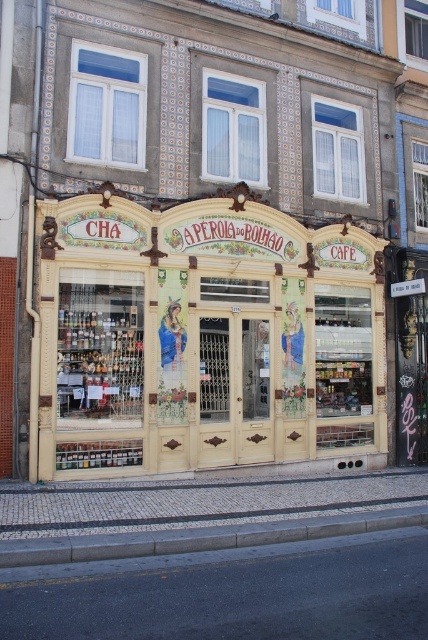
You are a delivery person trying to park your 1.2 meter wide cart in front of the yellow painted wood storefront at center. The gray concrete curb at lower center is in the way. Can your cart fit between the storefront and the curb?

The yellow painted wood storefront at center has a lesser width compared to gray concrete curb at lower center. Since the storefront is narrower, there might not be enough space for the 1.2 meter wide cart to fit between them. You should look for another parking spot.

You are standing in front of the traditional Portuguese cafe and want to enter. Which object, the yellow painted wood storefront at center or the gray concrete curb at lower center, is closer to your right side?

The gray concrete curb at lower center is closer to your right side because the yellow painted wood storefront at center is to the left of it.